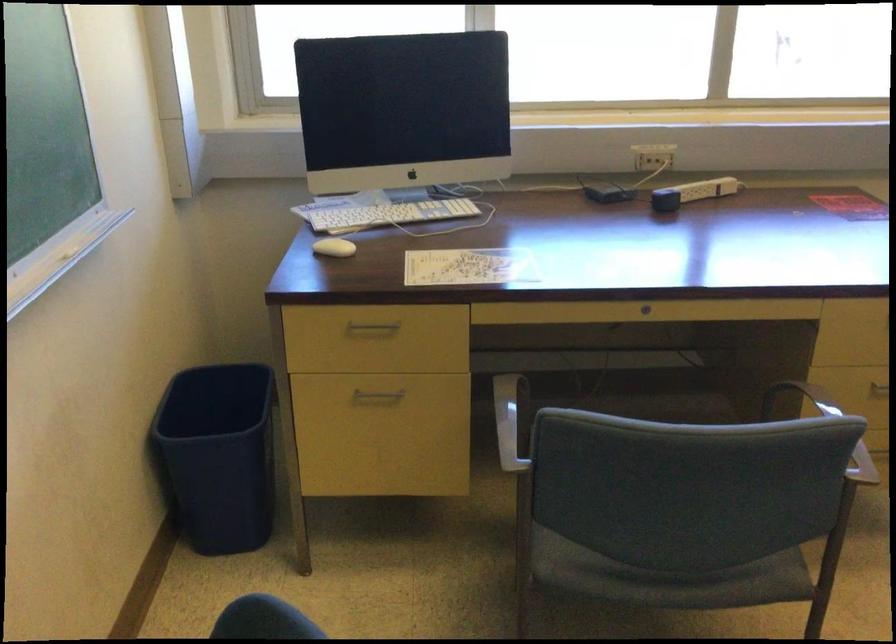
You are a GUI agent. You are given a task and a screenshot of the screen. Output one action in this format:
    pyautogui.click(x=<x>, y=<y>)
    Task: Click on the desk keyhole
    
    Given the screenshot: What is the action you would take?
    pyautogui.click(x=645, y=308)